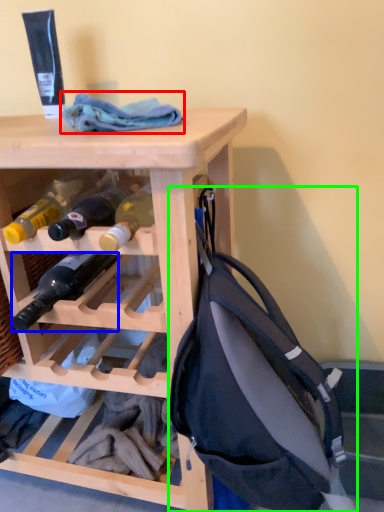
Question: Estimate the real-world distances between objects in this image. Which object is closer to cloth (highlighted by a red box), bottle (highlighted by a blue box) or backpack (highlighted by a green box)?

Choices:
 (A) bottle
 (B) backpack

Answer: (A)